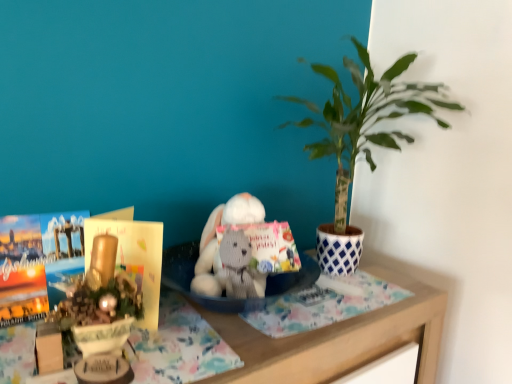
What is the approximate height of wooden table at center?

21.49 inches.

This screenshot has width=512, height=384. What do you see at coordinates (323, 304) in the screenshot?
I see `fluffy white cloth at center` at bounding box center [323, 304].

Measure the distance between fluffy white cloth at center and camera.

fluffy white cloth at center and camera are 81.40 centimeters apart.

The image size is (512, 384). What do you see at coordinates (232, 270) in the screenshot? I see `gray knitted stuffed animal at center` at bounding box center [232, 270].

Identify the location of matte paper book at left. Image resolution: width=512 pixels, height=384 pixels. (133, 258).

Can you tell me how much matte paper book at left and green leafy plant at upper right differ in facing direction?

40 degrees.

In terms of height, does matte paper book at left look taller or shorter compared to green leafy plant at upper right?

Clearly, matte paper book at left is shorter compared to green leafy plant at upper right.

Is matte paper book at left located outside green leafy plant at upper right?

Yes, matte paper book at left is located beyond the bounds of green leafy plant at upper right.

Between matte paper book at left and green leafy plant at upper right, which one has smaller size?

matte paper book at left is smaller.

Looking at this image, considering their positions, is fluffy white cloth at center located in front of or behind wooden table at center?

Clearly, fluffy white cloth at center is behind wooden table at center.

You are a GUI agent. You are given a task and a screenshot of the screen. Output one action in this format:
    pyautogui.click(x=<x>, y=<y>)
    Task: Click on the cloth that is above the wooden table at center (from the image's perspective)
    This screenshot has height=384, width=512.
    Given the screenshot: What is the action you would take?
    pyautogui.click(x=323, y=304)

Can wooden table at center be found inside fluffy white cloth at center?

No, fluffy white cloth at center does not contain wooden table at center.

From a real-world perspective, relative to gray knitted stuffed animal at center, is matte paper book at left vertically above or below?

From a real-world perspective, matte paper book at left is physically below gray knitted stuffed animal at center.

Considering the relative sizes of matte paper book at left and gray knitted stuffed animal at center in the image provided, is matte paper book at left thinner than gray knitted stuffed animal at center?

No, matte paper book at left is not thinner than gray knitted stuffed animal at center.

Based on the photo, considering the positions of objects matte paper book at left and gray knitted stuffed animal at center in the image provided, who is more to the left, matte paper book at left or gray knitted stuffed animal at center?

From the viewer's perspective, matte paper book at left appears more on the left side.

In the image, is matte paper book at left positioned in front of or behind gray knitted stuffed animal at center?

In the image, matte paper book at left appears in front of gray knitted stuffed animal at center.

Considering the positions of points (426, 308) and (226, 236), is point (426, 308) farther from camera compared to point (226, 236)?

Yes, it is.

From a real-world perspective, which is physically above, wooden table at center or gray knitted stuffed animal at center?

From a 3D spatial view, gray knitted stuffed animal at center is above.

Considering the relative sizes of wooden table at center and gray knitted stuffed animal at center in the image provided, is wooden table at center shorter than gray knitted stuffed animal at center?

Incorrect, the height of wooden table at center does not fall short of that of gray knitted stuffed animal at center.

You are a GUI agent. You are given a task and a screenshot of the screen. Output one action in this format:
    pyautogui.click(x=<x>, y=<y>)
    Task: Click on the table in front of the matte paper book at left
    
    Given the screenshot: What is the action you would take?
    pyautogui.click(x=335, y=340)

Does matte paper book at left have a greater height compared to wooden table at center?

In fact, matte paper book at left may be shorter than wooden table at center.

Is point (151, 253) positioned behind point (231, 331)?

No.

From the picture: From the image's perspective, who appears lower, matte paper book at left or wooden table at center?

From the image's view, wooden table at center is below.

Considering the relative sizes of wooden table at center and green leafy plant at upper right in the image provided, is wooden table at center shorter than green leafy plant at upper right?

Correct, wooden table at center is not as tall as green leafy plant at upper right.

Can you confirm if wooden table at center is thinner than green leafy plant at upper right?

No, wooden table at center is not thinner than green leafy plant at upper right.

Is wooden table at center oriented towards green leafy plant at upper right?

No, wooden table at center is not facing towards green leafy plant at upper right.

Consider the image. Which point is more forward, (x=237, y=246) or (x=256, y=327)?

Point (x=256, y=327)

Does gray knitted stuffed animal at center have a larger size compared to fluffy white cloth at center?

No, gray knitted stuffed animal at center is not bigger than fluffy white cloth at center.

Which object is further away from the camera, gray knitted stuffed animal at center or fluffy white cloth at center?

Positioned behind is fluffy white cloth at center.

This screenshot has width=512, height=384. In order to click on paperback book that appears on the left of green leafy plant at upper right in this screenshot , I will do `click(133, 258)`.

You are a GUI agent. You are given a task and a screenshot of the screen. Output one action in this format:
    pyautogui.click(x=<x>, y=<y>)
    Task: Click on the table lying in front of the fluffy white cloth at center
    This screenshot has height=384, width=512.
    Given the screenshot: What is the action you would take?
    pyautogui.click(x=335, y=340)

Which object lies nearer to the anchor point gray knitted stuffed animal at center, fluffy white cloth at center or wooden table at center?

fluffy white cloth at center is positioned closer to the anchor gray knitted stuffed animal at center.

From the picture: Looking at the image, which one is located closer to fluffy white cloth at center, wooden table at center or matte paper book at left?

wooden table at center lies closer to fluffy white cloth at center than the other object.

Based on their spatial positions, is wooden table at center or gray knitted stuffed animal at center closer to matte paper book at left?

Among the two, gray knitted stuffed animal at center is located nearer to matte paper book at left.

When comparing their distances from wooden table at center, does matte paper book at left or green leafy plant at upper right seem further?

The object further to wooden table at center is green leafy plant at upper right.

When comparing their distances from fluffy white cloth at center, does wooden table at center or green leafy plant at upper right seem further?

Based on the image, green leafy plant at upper right appears to be further to fluffy white cloth at center.

From the image, which object appears to be nearer to fluffy white cloth at center, green leafy plant at upper right or gray knitted stuffed animal at center?

Among the two, gray knitted stuffed animal at center is located nearer to fluffy white cloth at center.

Looking at the image, which one is located closer to gray knitted stuffed animal at center, matte paper book at left or green leafy plant at upper right?

matte paper book at left.

When comparing their distances from wooden table at center, does green leafy plant at upper right or fluffy white cloth at center seem closer?

Among the two, fluffy white cloth at center is located nearer to wooden table at center.

You are a GUI agent. You are given a task and a screenshot of the screen. Output one action in this format:
    pyautogui.click(x=<x>, y=<y>)
    Task: Click on the animal situated between matte paper book at left and green leafy plant at upper right from left to right
    The height and width of the screenshot is (384, 512).
    Given the screenshot: What is the action you would take?
    pyautogui.click(x=232, y=270)

Where is `animal between green leafy plant at upper right and wooden table at center vertically`? The height and width of the screenshot is (384, 512). animal between green leafy plant at upper right and wooden table at center vertically is located at coordinates (232, 270).

The width and height of the screenshot is (512, 384). In order to click on animal situated between matte paper book at left and fluffy white cloth at center from left to right in this screenshot , I will do `click(232, 270)`.

The width and height of the screenshot is (512, 384). I want to click on cloth situated between matte paper book at left and green leafy plant at upper right from left to right, so click(323, 304).